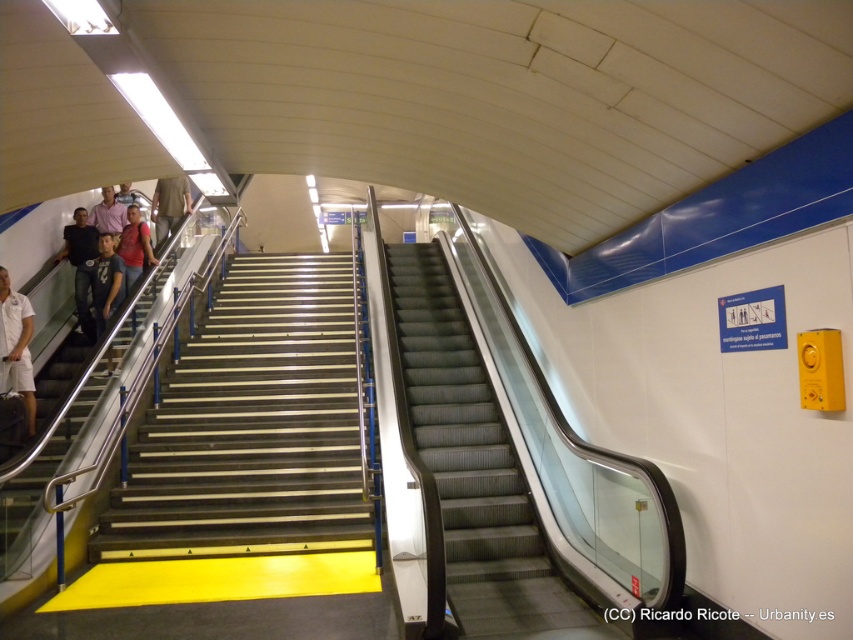
Question: Which point appears closest to the camera in this image?

Choices:
 (A) (94, 266)
 (B) (91, 211)

Answer: (A)

Question: Is dark blue shirt at left closer to camera compared to light purple shirt at upper left?

Choices:
 (A) no
 (B) yes

Answer: (B)

Question: Which object appears farthest from the camera in this image?

Choices:
 (A) white cotton shirt at left
 (B) matte red shirt at left

Answer: (B)

Question: Can you confirm if metallic stairs at center is thinner than black rubber stairs at right?

Choices:
 (A) yes
 (B) no

Answer: (B)

Question: Which object appears farthest from the camera in this image?

Choices:
 (A) matte red shirt at left
 (B) dark blue jeans at left
 (C) metallic stairs at center
 (D) white cotton shirt at left

Answer: (A)

Question: Is white cotton shirt at left in front of dark blue jeans at left?

Choices:
 (A) no
 (B) yes

Answer: (B)